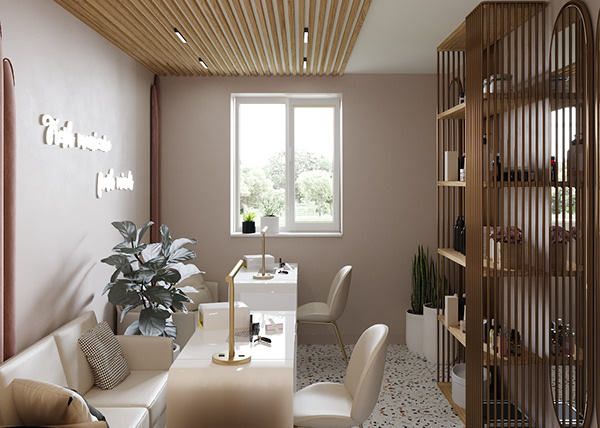
This screenshot has width=600, height=428. I want to click on jar, so click(x=458, y=379), click(x=500, y=83), click(x=484, y=84), click(x=448, y=164).